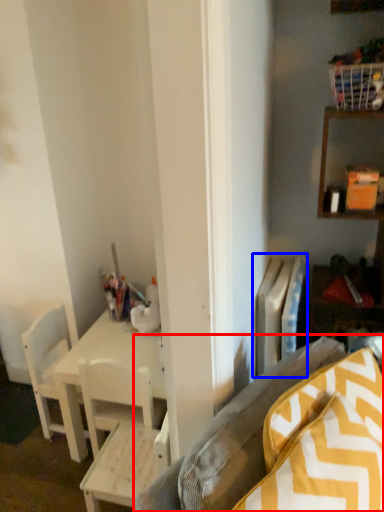
Question: Among these objects, which one is farthest to the camera, studio couch (highlighted by a red box) or radiator (highlighted by a blue box)?

Choices:
 (A) studio couch
 (B) radiator

Answer: (B)